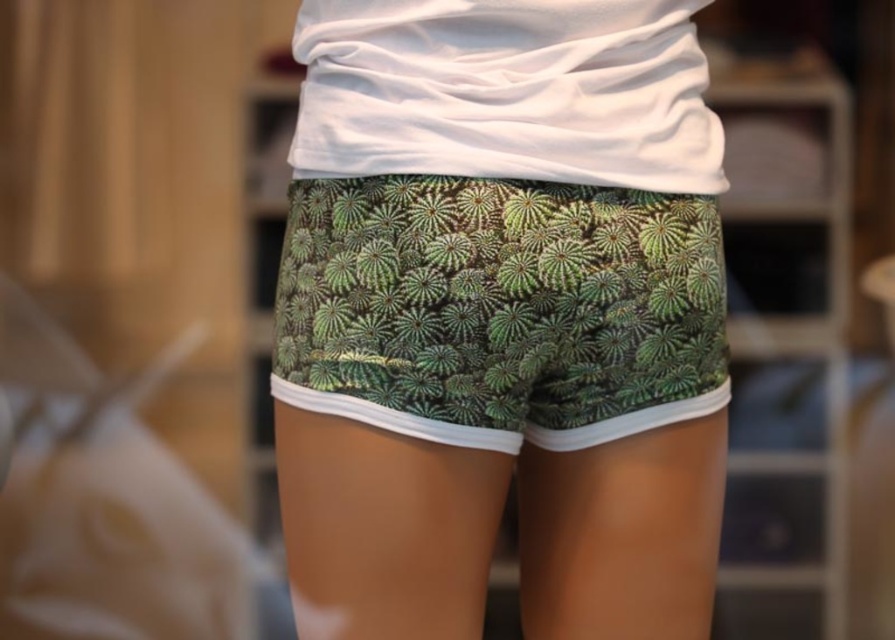
Is green printed shorts at center taller than green leafy fabric shorts at center?

Yes.

Is point (587, 26) in front of point (516, 396)?

Yes, it is.

Which is in front, point (473, 77) or point (561, 266)?

Point (473, 77) is more forward.

The height and width of the screenshot is (640, 895). Find the location of `green printed shorts at center`. green printed shorts at center is located at coordinates (501, 316).